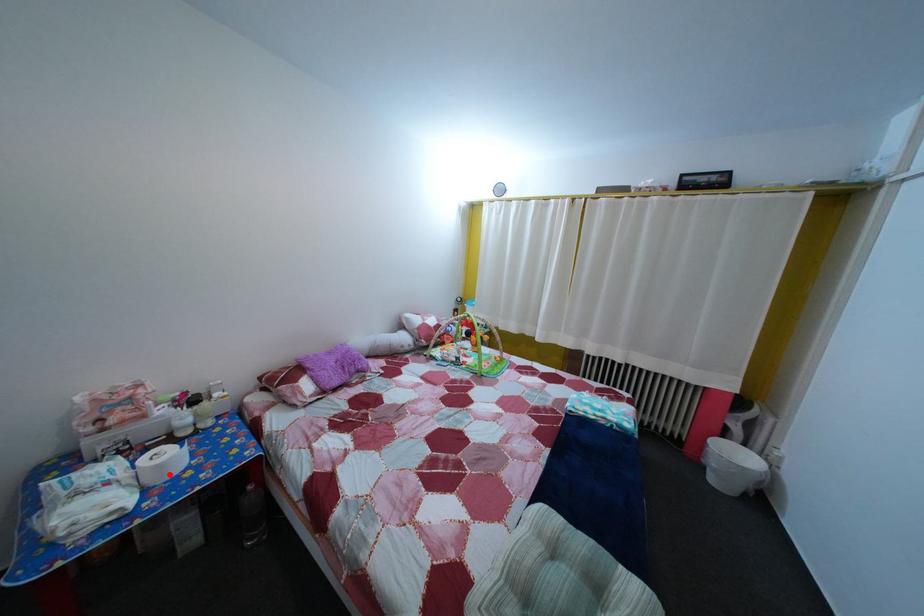
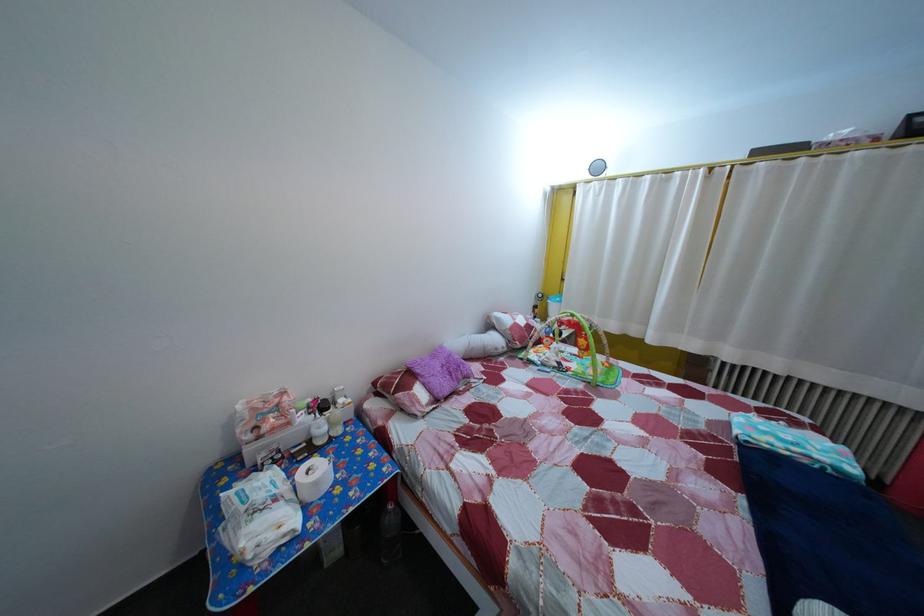
In the second image, find the point that corresponds to the highlighted location in the first image.

(325, 491)